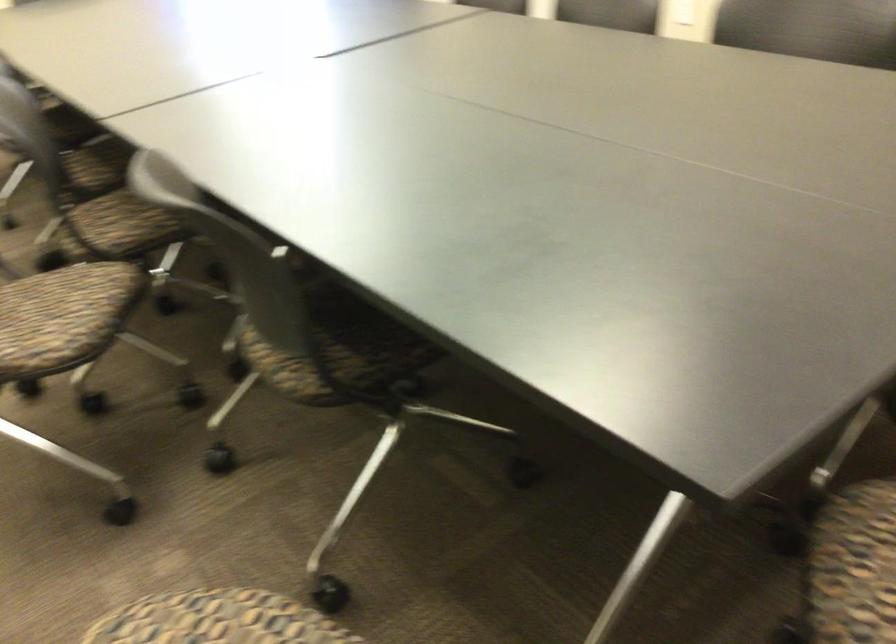
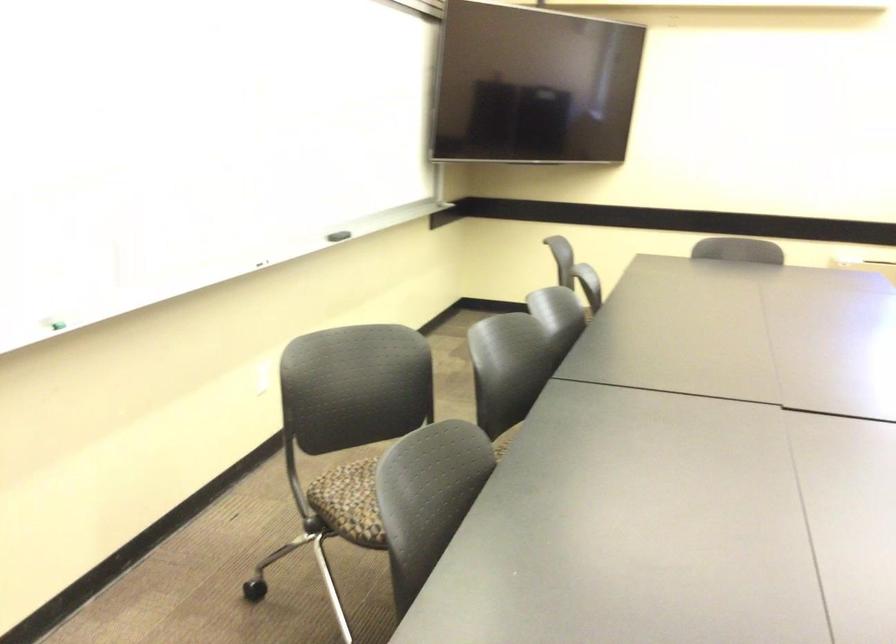
Question: I am providing you with two images of the same scene from different viewpoints. After the viewpoint changes to image2, which objects are now occluded?

Choices:
 (A) green whiteboard marker
 (B) black whiteboard eraser
 (C) mop head button
 (D) patterned chair sitting surface

Answer: (D)